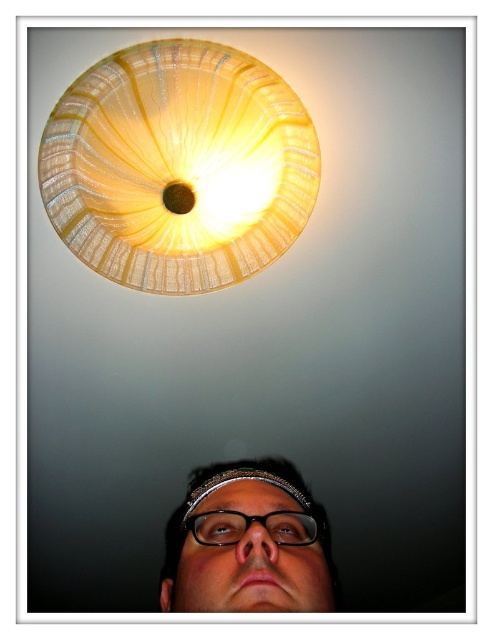
Question: Which point is farther to the camera?

Choices:
 (A) translucent glass lampshade at upper center
 (B) matte black glasses at lower center

Answer: (A)

Question: Does translucent glass lampshade at upper center have a larger size compared to matte black glasses at lower center?

Choices:
 (A) yes
 (B) no

Answer: (A)

Question: Which of the following is the closest to the observer?

Choices:
 (A) (199, 557)
 (B) (231, 131)

Answer: (A)

Question: Does translucent glass lampshade at upper center have a smaller size compared to matte black glasses at lower center?

Choices:
 (A) no
 (B) yes

Answer: (A)

Question: Does translucent glass lampshade at upper center appear under matte black glasses at lower center?

Choices:
 (A) yes
 (B) no

Answer: (B)